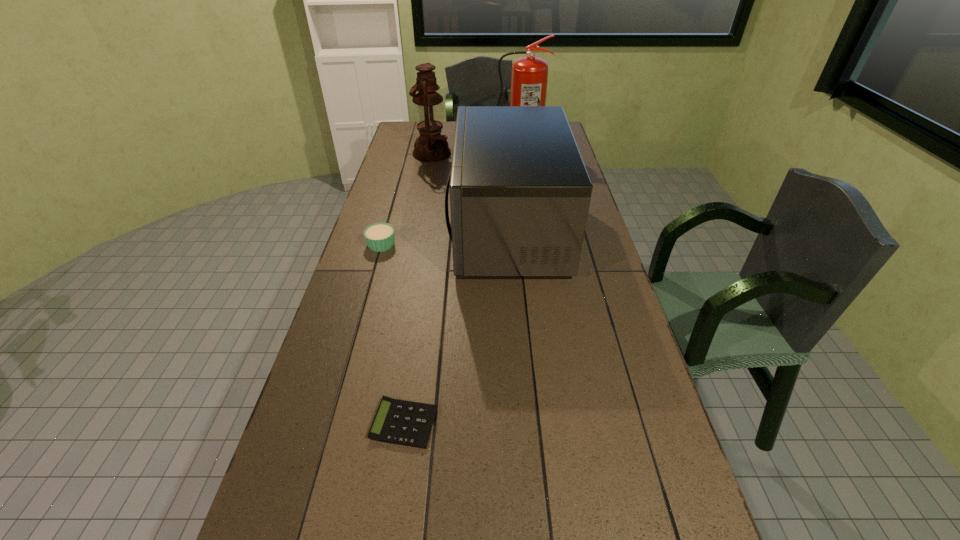
Identify the location of the tallest object. This screenshot has width=960, height=540. (529, 77).

The image size is (960, 540). Find the location of `oil lamp`. oil lamp is located at coordinates (430, 146).

Where is `microwave oven`? microwave oven is located at coordinates (520, 193).

Find the location of `the fourth tallest object`. the fourth tallest object is located at coordinates click(379, 237).

The image size is (960, 540). I want to click on the nearest object, so click(x=400, y=422).

Identify the location of the shortest object. The height and width of the screenshot is (540, 960). (400, 422).

Find the location of a particular element. vacant region located on the instruction side of the tallest object is located at coordinates (521, 186).

Where is `vacant region located on the right of the oil lamp`? Image resolution: width=960 pixels, height=540 pixels. vacant region located on the right of the oil lamp is located at coordinates (485, 153).

In order to click on free space located 0.240m on the front-facing side of the microwave oven in this screenshot , I will do `click(385, 230)`.

Identify the location of vacant area situated 0.060m on the front-facing side of the microwave oven. (434, 230).